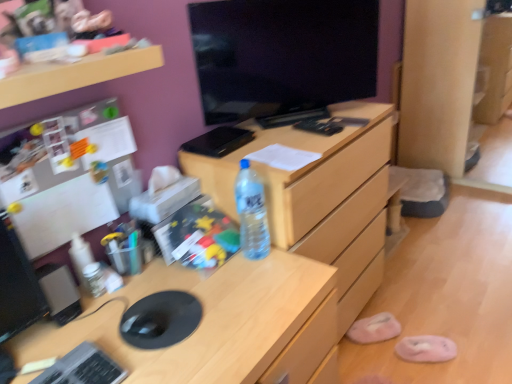
Image resolution: width=512 pixels, height=384 pixels. Find the location of `vacant area situated to the left side of translucent plastic water bottle at center`. vacant area situated to the left side of translucent plastic water bottle at center is located at coordinates (213, 268).